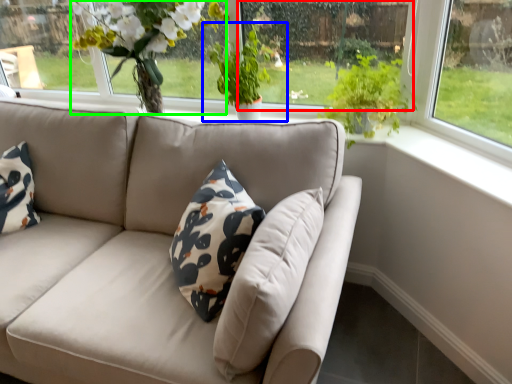
Question: Considering the real-world distances, which object is closest to window screen (highlighted by a red box)? houseplant (highlighted by a blue box) or floral arrangement (highlighted by a green box).

Choices:
 (A) houseplant
 (B) floral arrangement

Answer: (A)